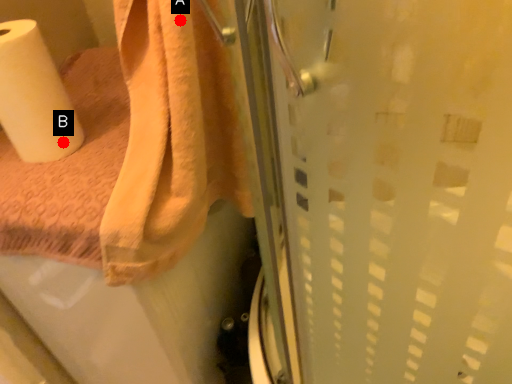
Question: Two points are circled on the image, labeled by A and B beside each circle. Which of the following is the closest to the observer?

Choices:
 (A) A is closer
 (B) B is closer

Answer: (A)